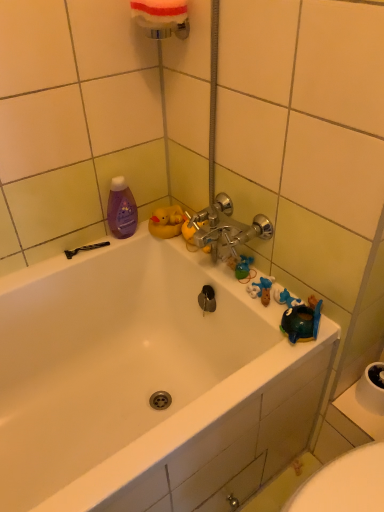
Question: Is white glossy bathtub at upper center not within purple glossy bottle at upper left?

Choices:
 (A) no
 (B) yes

Answer: (B)

Question: Is white glossy bathtub at upper center further to camera compared to purple glossy bottle at upper left?

Choices:
 (A) no
 (B) yes

Answer: (A)

Question: Does white glossy bathtub at upper center have a larger size compared to purple glossy bottle at upper left?

Choices:
 (A) yes
 (B) no

Answer: (A)

Question: Can you confirm if white glossy bathtub at upper center is thinner than purple glossy bottle at upper left?

Choices:
 (A) yes
 (B) no

Answer: (B)

Question: Is purple glossy bottle at upper left surrounded by white glossy bathtub at upper center?

Choices:
 (A) no
 (B) yes

Answer: (A)

Question: Can you confirm if white glossy bathtub at upper center is positioned to the left of purple glossy bottle at upper left?

Choices:
 (A) no
 (B) yes

Answer: (A)

Question: Can you confirm if purple glossy bottle at upper left is positioned to the right of black plastic razor at lower left?

Choices:
 (A) yes
 (B) no

Answer: (A)

Question: Is purple glossy bottle at upper left positioned with its back to black plastic razor at lower left?

Choices:
 (A) yes
 (B) no

Answer: (B)

Question: From a real-world perspective, is purple glossy bottle at upper left located beneath black plastic razor at lower left?

Choices:
 (A) yes
 (B) no

Answer: (B)

Question: Is purple glossy bottle at upper left directly adjacent to black plastic razor at lower left?

Choices:
 (A) yes
 (B) no

Answer: (B)

Question: Is black plastic razor at lower left completely or partially inside purple glossy bottle at upper left?

Choices:
 (A) yes
 (B) no

Answer: (B)

Question: Considering the relative sizes of purple glossy bottle at upper left and black plastic razor at lower left in the image provided, is purple glossy bottle at upper left shorter than black plastic razor at lower left?

Choices:
 (A) no
 (B) yes

Answer: (A)

Question: Is the depth of white glossy bathtub at upper center less than that of white foam sponge at upper center?

Choices:
 (A) yes
 (B) no

Answer: (A)